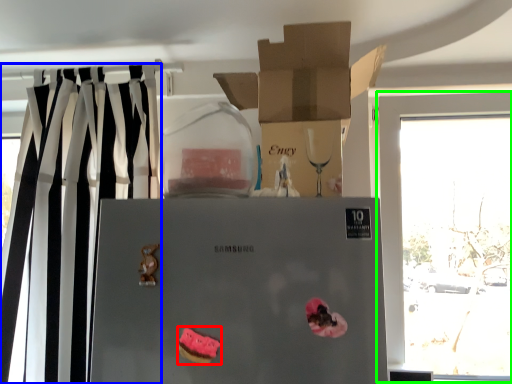
Question: Based on their relative distances, which object is nearer to stuff (highlighted by a red box)? Choose from curtain (highlighted by a blue box) and window (highlighted by a green box).

Choices:
 (A) curtain
 (B) window

Answer: (A)